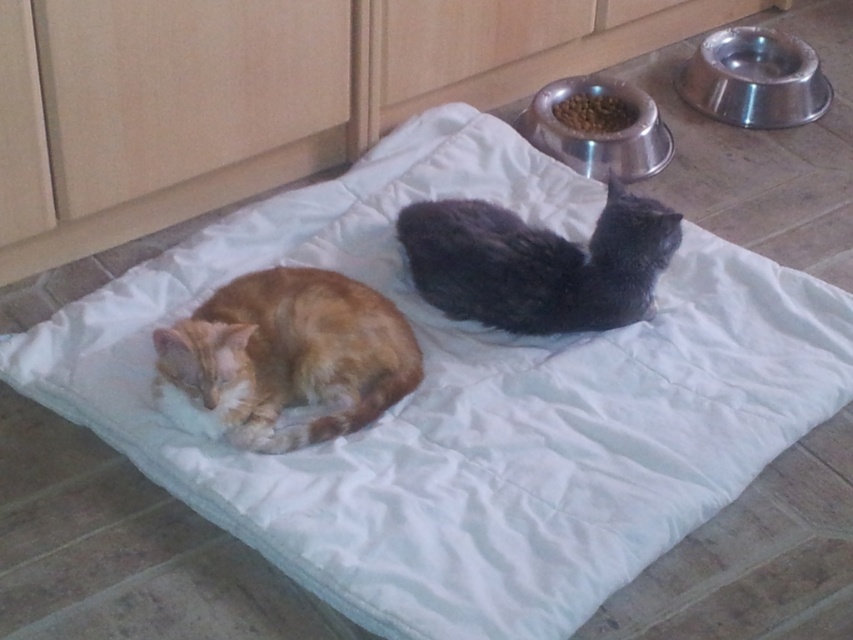
Is orange fur cat at left wider than black fluffy cat at center?

Incorrect, orange fur cat at left's width does not surpass black fluffy cat at center's.

Can you confirm if orange fur cat at left is positioned above black fluffy cat at center?

No, orange fur cat at left is not above black fluffy cat at center.

You are a GUI agent. You are given a task and a screenshot of the screen. Output one action in this format:
    pyautogui.click(x=<x>, y=<y>)
    Task: Click on the orange fur cat at left
    Image resolution: width=853 pixels, height=640 pixels.
    Given the screenshot: What is the action you would take?
    pyautogui.click(x=283, y=358)

Identify the location of orange fur cat at left. The width and height of the screenshot is (853, 640). (283, 358).

Is orange fur cat at left further to camera compared to metallic silver bowl at upper right?

That is False.

Is orange fur cat at left to the left of metallic silver bowl at upper right from the viewer's perspective?

Yes, orange fur cat at left is to the left of metallic silver bowl at upper right.

Is point (410, 372) positioned behind point (650, 99)?

No, it is not.

Find the location of a particular element. The image size is (853, 640). orange fur cat at left is located at coordinates (283, 358).

From the picture: Does black fluffy cat at center have a larger size compared to metallic silver bowl at upper right?

Indeed, black fluffy cat at center has a larger size compared to metallic silver bowl at upper right.

Between black fluffy cat at center and metallic silver bowl at upper right, which one has less height?

With less height is black fluffy cat at center.

From the picture: Who is more forward, (x=469, y=237) or (x=636, y=134)?

Point (x=469, y=237) is in front.

Identify the location of black fluffy cat at center. (538, 262).